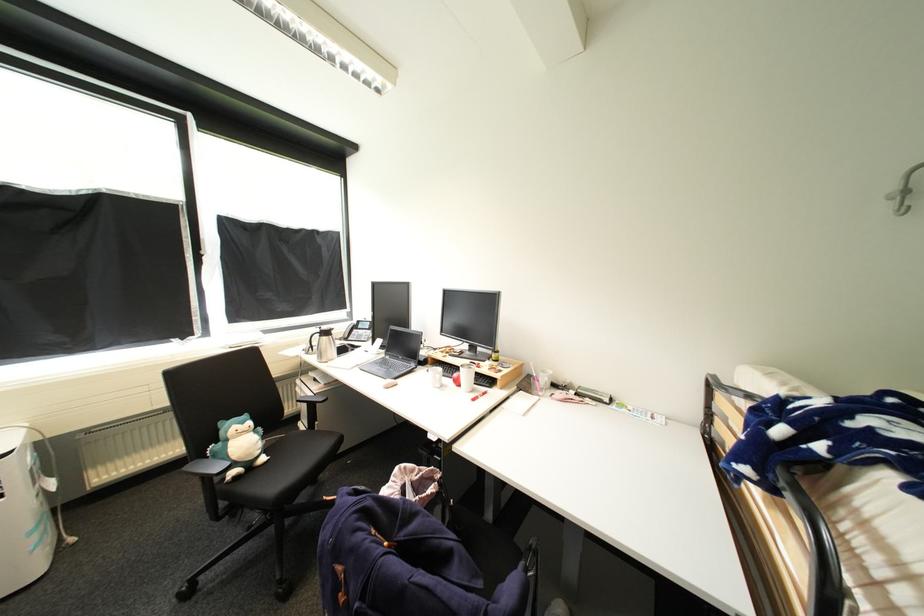
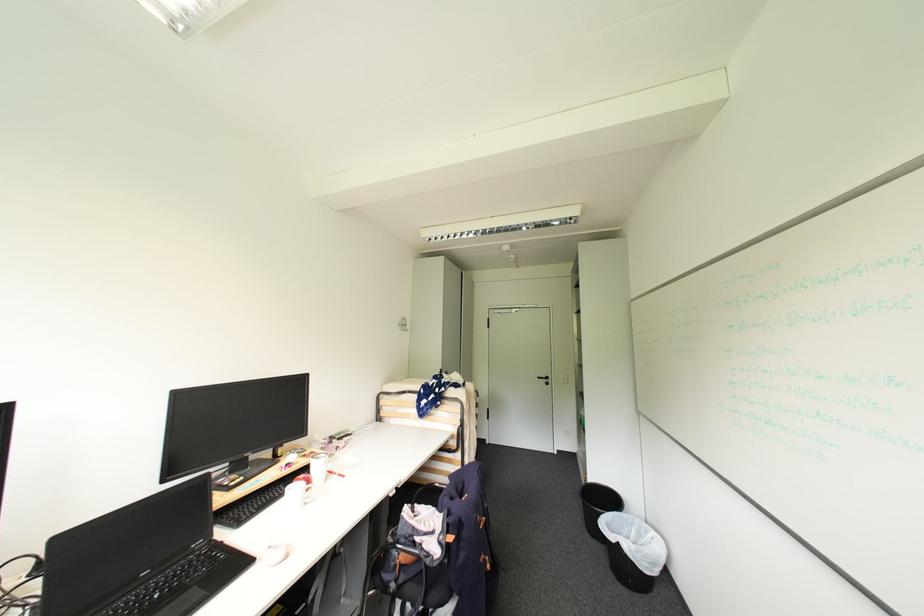
Locate, in the second image, the point that corresponds to point 445,477 in the first image.

(417, 506)